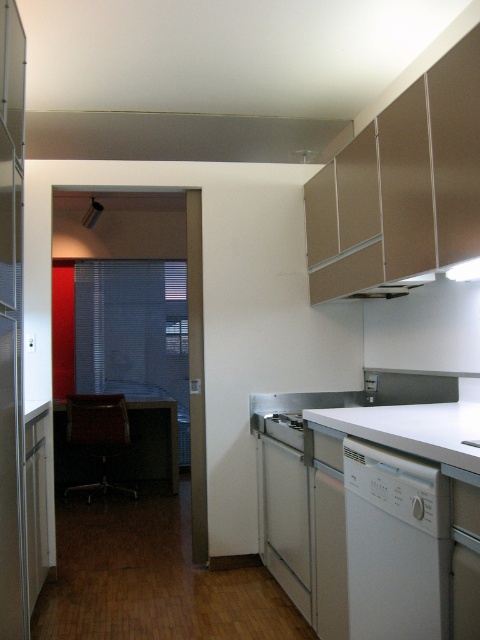
Does white matte countertop at lower right appear over white glossy stove at lower center?

Yes.

Is white matte countertop at lower right wider than white glossy stove at lower center?

Correct, the width of white matte countertop at lower right exceeds that of white glossy stove at lower center.

The image size is (480, 640). Describe the element at coordinates (411, 428) in the screenshot. I see `white matte countertop at lower right` at that location.

Identify the location of white matte countertop at lower right. This screenshot has height=640, width=480. (411, 428).

Who is more distant from viewer, [350,557] or [300,436]?

The point [300,436] is more distant.

Which is below, white matte dishwasher at lower right or white glossy stove at lower center?

white matte dishwasher at lower right is lower down.

Image resolution: width=480 pixels, height=640 pixels. I want to click on white matte dishwasher at lower right, so click(x=396, y=545).

In the scene shown: Which is above, white matte dishwasher at lower right or white matte countertop at lower right?

white matte countertop at lower right is higher up.

Between point (361, 531) and point (419, 436), which one is positioned behind?

The point (361, 531) is behind.

This screenshot has height=640, width=480. What are the coordinates of `white matte dishwasher at lower right` in the screenshot? It's located at (396, 545).